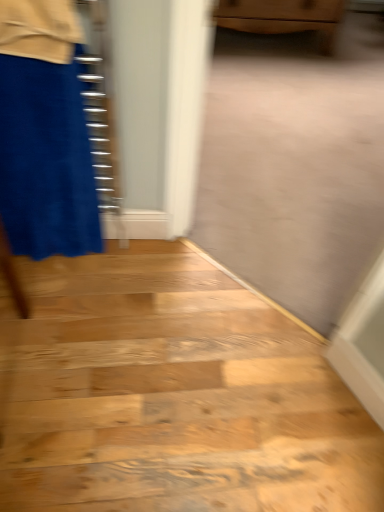
Locate an element on the screen. wooden cabinet at upper center is located at coordinates (283, 18).

What is the approximate width of velvet blue miniskirt at left?

It is 4.67 inches.

What is the approximate width of wooden floor at lower left?

The width of wooden floor at lower left is 38.77 inches.

Find the location of a particular element. wooden cabinet at upper center is located at coordinates (283, 18).

Considering the relative sizes of wooden cabinet at upper center and wooden floor at lower left in the image provided, is wooden cabinet at upper center bigger than wooden floor at lower left?

Indeed, wooden cabinet at upper center has a larger size compared to wooden floor at lower left.

Based on the photo, between wooden cabinet at upper center and wooden floor at lower left, which one has smaller width?

With smaller width is wooden cabinet at upper center.

Locate an element on the screen. stairwell in front of the wooden cabinet at upper center is located at coordinates (171, 395).

Can we say wooden cabinet at upper center lies outside wooden floor at lower left?

wooden cabinet at upper center lies outside wooden floor at lower left's area.

Where is `furniture on the right side of wooden floor at lower left`? This screenshot has height=512, width=384. furniture on the right side of wooden floor at lower left is located at coordinates (x=283, y=18).

Which of these two, wooden floor at lower left or wooden cabinet at upper center, is bigger?

wooden cabinet at upper center is bigger.

Can you confirm if wooden floor at lower left is thinner than wooden cabinet at upper center?

Incorrect, the width of wooden floor at lower left is not less than that of wooden cabinet at upper center.

Is wooden floor at lower left spatially inside wooden cabinet at upper center, or outside of it?

wooden floor at lower left is not enclosed by wooden cabinet at upper center.

Find the location of `miniskirt above the wooden cabinet at upper center (from a real-world perspective)`. miniskirt above the wooden cabinet at upper center (from a real-world perspective) is located at coordinates (46, 161).

Are velvet blue miniskirt at left and wooden cabinet at upper center far apart?

Yes, velvet blue miniskirt at left is far from wooden cabinet at upper center.

From a real-world perspective, who is located lower, velvet blue miniskirt at left or wooden cabinet at upper center?

wooden cabinet at upper center is physically lower.

Would you say wooden floor at lower left is to the left or to the right of velvet blue miniskirt at left in the picture?

Based on their positions, wooden floor at lower left is located to the right of velvet blue miniskirt at left.

Find the location of a particular element. This screenshot has height=512, width=384. miniskirt lying on the left of wooden floor at lower left is located at coordinates (46, 161).

From a real-world perspective, relative to velvet blue miniskirt at left, is wooden floor at lower left vertically above or below?

wooden floor at lower left is situated lower than velvet blue miniskirt at left in the real world.

In the scene shown: Based on their sizes in the image, would you say wooden floor at lower left is bigger or smaller than velvet blue miniskirt at left?

Considering their sizes, wooden floor at lower left takes up more space than velvet blue miniskirt at left.

From the picture: Which of these two, wooden cabinet at upper center or velvet blue miniskirt at left, stands taller?

Standing taller between the two is velvet blue miniskirt at left.

Which is behind, point (300, 5) or point (64, 190)?

The point (300, 5) is behind.

Looking at this image, does wooden cabinet at upper center appear on the right side of velvet blue miniskirt at left?

Correct, you'll find wooden cabinet at upper center to the right of velvet blue miniskirt at left.

Can velvet blue miniskirt at left be found inside wooden cabinet at upper center?

No, velvet blue miniskirt at left is located outside of wooden cabinet at upper center.

Is wooden floor at lower left inside velvet blue miniskirt at left?

Actually, wooden floor at lower left is outside velvet blue miniskirt at left.

From the image's perspective, is velvet blue miniskirt at left above or below wooden floor at lower left?

From the image's perspective, velvet blue miniskirt at left appears above wooden floor at lower left.

Considering the positions of points (52, 155) and (161, 418), is point (52, 155) closer to camera compared to point (161, 418)?

Yes, point (52, 155) is in front of point (161, 418).

In the scene shown: Which object is more forward, velvet blue miniskirt at left or wooden floor at lower left?

velvet blue miniskirt at left is closer to the camera.

Where is `furniture lying behind the wooden floor at lower left`? This screenshot has width=384, height=512. furniture lying behind the wooden floor at lower left is located at coordinates (283, 18).

I want to click on stairwell in front of the wooden cabinet at upper center, so click(x=171, y=395).

In the scene shown: Based on their spatial positions, is wooden cabinet at upper center or wooden floor at lower left closer to velvet blue miniskirt at left?

wooden floor at lower left lies closer to velvet blue miniskirt at left than the other object.

When comparing their distances from velvet blue miniskirt at left, does wooden floor at lower left or wooden cabinet at upper center seem closer?

The object closer to velvet blue miniskirt at left is wooden floor at lower left.

Which object lies further to the anchor point wooden cabinet at upper center, velvet blue miniskirt at left or wooden floor at lower left?

wooden floor at lower left lies further to wooden cabinet at upper center than the other object.

From the image, which object appears to be nearer to wooden cabinet at upper center, wooden floor at lower left or velvet blue miniskirt at left?

Based on the image, velvet blue miniskirt at left appears to be nearer to wooden cabinet at upper center.

Which object lies nearer to the anchor point wooden floor at lower left, velvet blue miniskirt at left or wooden cabinet at upper center?

velvet blue miniskirt at left is positioned closer to the anchor wooden floor at lower left.

From the image, which object appears to be nearer to wooden floor at lower left, wooden cabinet at upper center or velvet blue miniskirt at left?

The object closer to wooden floor at lower left is velvet blue miniskirt at left.

Locate an element on the screen. The height and width of the screenshot is (512, 384). miniskirt between wooden cabinet at upper center and wooden floor at lower left vertically is located at coordinates (46, 161).